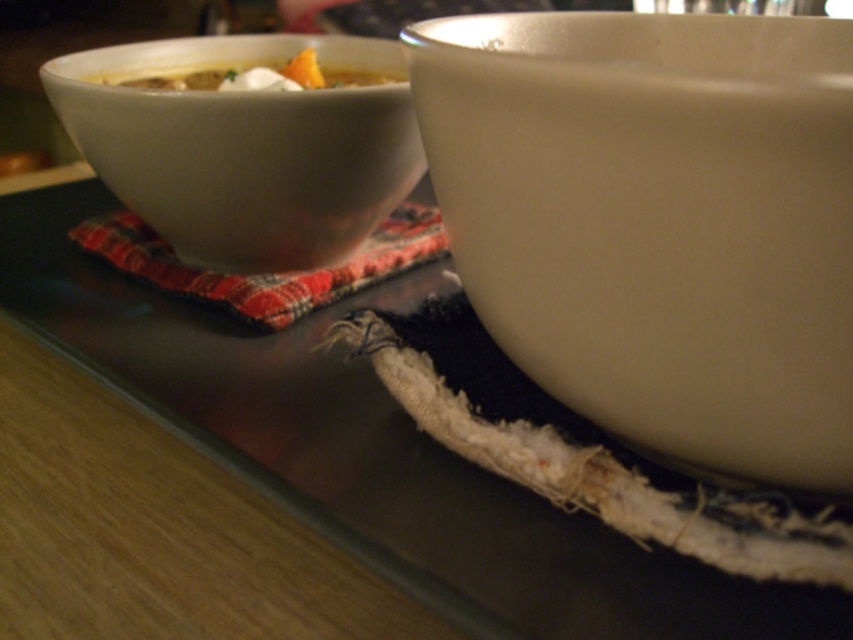
Question: Which point appears farthest from the camera in this image?

Choices:
 (A) [x=709, y=164]
 (B) [x=321, y=129]

Answer: (B)

Question: Can you confirm if matte white bowl at center is positioned below yellow matte soup at upper left?

Choices:
 (A) yes
 (B) no

Answer: (A)

Question: Which point is farther to the camera?

Choices:
 (A) red plaid cloth at upper left
 (B) yellow matte soup at upper left
 (C) matte white bowl at center

Answer: (A)

Question: From the image, what is the correct spatial relationship of matte white bowl at center in relation to matte white bowl at left?

Choices:
 (A) left
 (B) right

Answer: (B)

Question: Which point is closer to the camera?

Choices:
 (A) matte white bowl at center
 (B) matte white bowl at left

Answer: (A)

Question: Can you confirm if matte white bowl at left is positioned to the right of red plaid cloth at upper left?

Choices:
 (A) no
 (B) yes

Answer: (A)